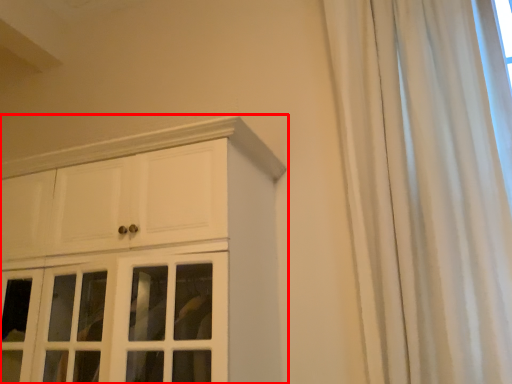
Question: Where is cupboard (annotated by the red box) located in relation to curtain in the image?

Choices:
 (A) right
 (B) left

Answer: (B)